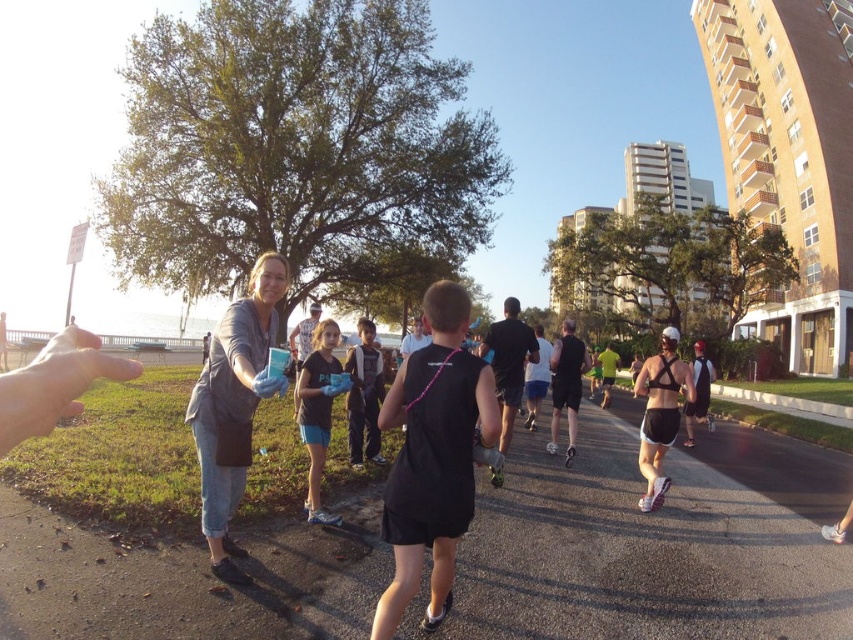
Question: Does black matte tank top at center have a lesser width compared to matte blue shorts at center?

Choices:
 (A) yes
 (B) no

Answer: (B)

Question: Is black matte tank top at center to the left of denim jacket at center from the viewer's perspective?

Choices:
 (A) no
 (B) yes

Answer: (A)

Question: Which point is closer to the camera taking this photo?

Choices:
 (A) (318, 461)
 (B) (466, 424)

Answer: (B)

Question: Can you confirm if black matte tank top at center is bigger than denim jacket at center?

Choices:
 (A) no
 (B) yes

Answer: (A)

Question: Which of the following is the farthest from the observer?

Choices:
 (A) matte blue shorts at center
 (B) black matte tank top at center
 (C) denim jacket at center
 (D) black fabric runner at center

Answer: (A)

Question: Which is nearer to the black fabric runner at center?

Choices:
 (A) matte blue shorts at center
 (B) black matte tank top at center

Answer: (B)